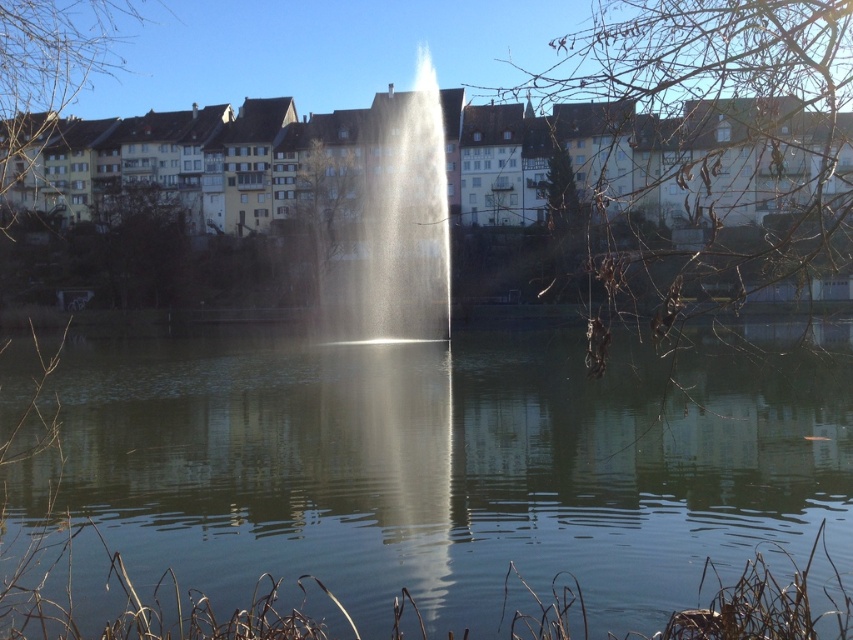
Question: Which of the following is the closest to the observer?

Choices:
 (A) (405, 97)
 (B) (770, 477)

Answer: (B)

Question: Is clear water at center smaller than clear glass fountain at center?

Choices:
 (A) no
 (B) yes

Answer: (A)

Question: Is the position of clear water at center less distant than that of clear glass fountain at center?

Choices:
 (A) yes
 (B) no

Answer: (A)

Question: Which object appears closest to the camera in this image?

Choices:
 (A) clear glass fountain at center
 (B) clear water at center

Answer: (B)

Question: Can you confirm if clear water at center is positioned above clear glass fountain at center?

Choices:
 (A) yes
 (B) no

Answer: (B)